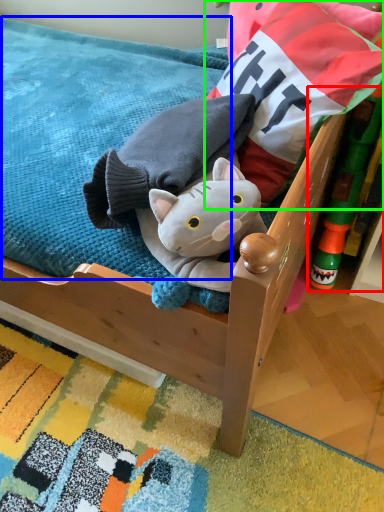
Question: Estimate the real-world distances between objects in this image. Which object is farther from toy (highlighted by a red box), mattress (highlighted by a blue box) or pillow (highlighted by a green box)?

Choices:
 (A) mattress
 (B) pillow

Answer: (A)